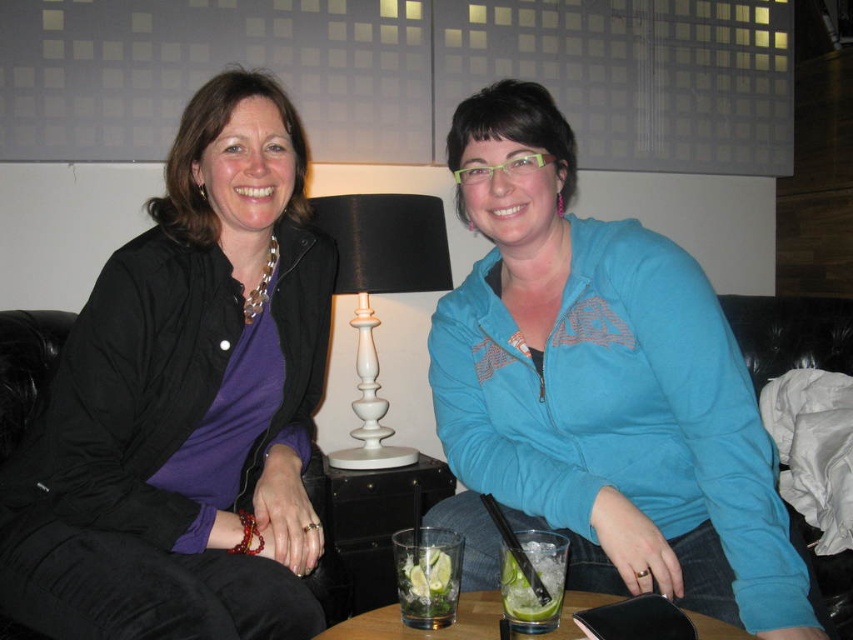
Question: Does translucent glass table at center have a lesser width compared to clear glass with lime slices at lower center?

Choices:
 (A) no
 (B) yes

Answer: (A)

Question: Is blue fleece jacket at center to the left of translucent glass table at center from the viewer's perspective?

Choices:
 (A) no
 (B) yes

Answer: (A)

Question: Which of the following is the farthest from the observer?

Choices:
 (A) white glossy lamp at center
 (B) matte black jacket at center
 (C) clear glass at center

Answer: (A)

Question: Which object is positioned farthest from the matte black jacket at center?

Choices:
 (A) clear glass with lime slices at lower center
 (B) white glossy lamp at center

Answer: (B)

Question: Which object is farther from the camera taking this photo?

Choices:
 (A) translucent glass table at center
 (B) blue fleece jacket at center
 (C) matte black jacket at center
 (D) clear glass with lime slices at lower center

Answer: (C)

Question: Observing the image, what is the correct spatial positioning of white glossy lamp at center in reference to translucent glass table at center?

Choices:
 (A) above
 (B) below

Answer: (A)